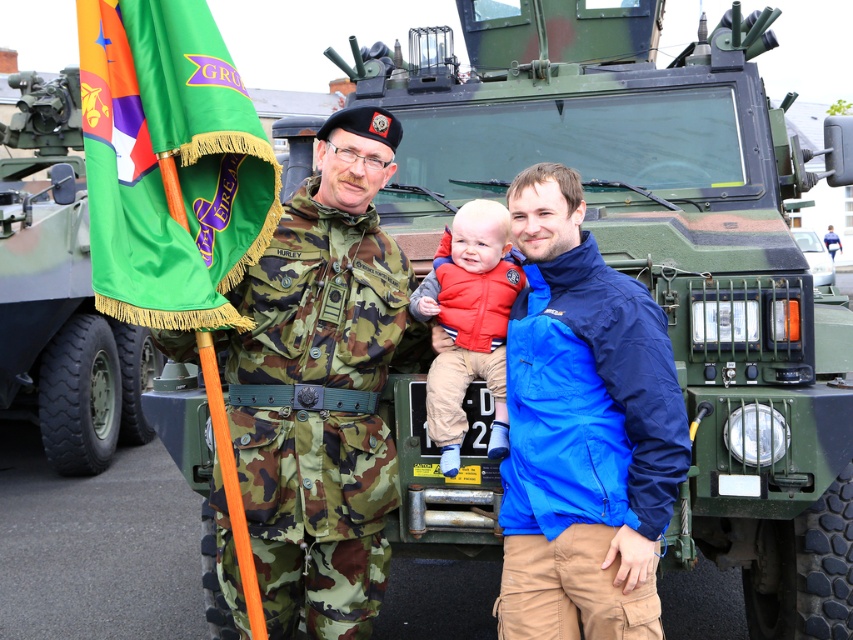
Question: Is green camouflage tank at left below camouflage fabric uniform at center?

Choices:
 (A) yes
 (B) no

Answer: (A)

Question: Does camouflage fabric uniform at left lie in front of camouflage fabric uniform at center?

Choices:
 (A) yes
 (B) no

Answer: (A)

Question: Based on their relative distances, which object is nearer to the blue fabric jacket at center?

Choices:
 (A) red fleece vest at center
 (B) camouflage fabric uniform at center
 (C) green camouflage tank at left
 (D) green fabric flag at left

Answer: (A)

Question: Where is blue fabric jacket at center located in relation to green camouflage tank at left in the image?

Choices:
 (A) below
 (B) above

Answer: (A)

Question: Which point is farther to the camera?

Choices:
 (A) green fabric flag at left
 (B) blue fabric jacket at center
 (C) green camouflage tank at left
 (D) camouflage fabric uniform at center

Answer: (D)

Question: Based on their relative distances, which object is nearer to the green fabric flag at left?

Choices:
 (A) green camouflage tank at left
 (B) blue fabric jacket at center
 (C) camouflage fabric uniform at left
 (D) red fleece vest at center

Answer: (C)